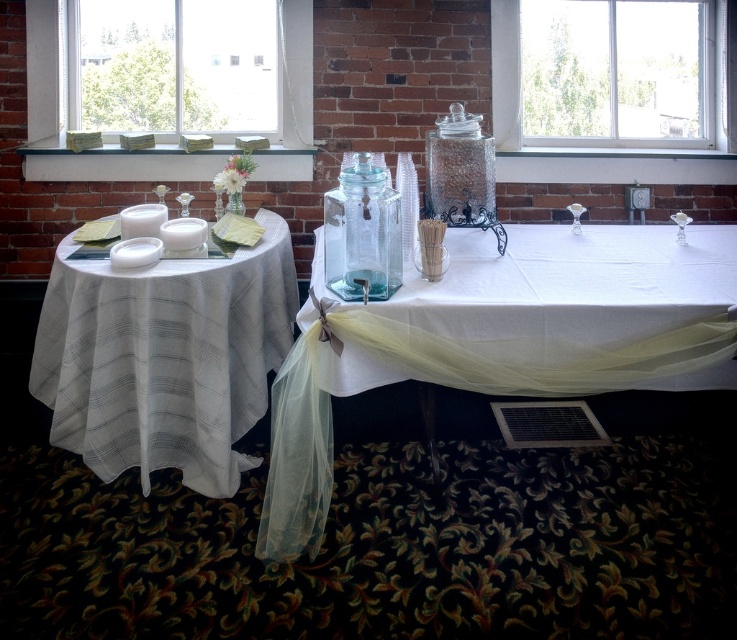
Measure the distance from translucent yellow fabric at lower center to green glass jars at upper left.

A distance of 1.56 meters exists between translucent yellow fabric at lower center and green glass jars at upper left.

Does point (680, 362) lie behind point (304, 83)?

No, (680, 362) is closer to viewer.

You are a GUI agent. You are given a task and a screenshot of the screen. Output one action in this format:
    pyautogui.click(x=<x>, y=<y>)
    Task: Click on the translucent yellow fabric at lower center
    The image size is (737, 640).
    Given the screenshot: What is the action you would take?
    pyautogui.click(x=499, y=342)

Does point (349, 273) come in front of point (178, 227)?

Yes, it is in front of point (178, 227).

Can you confirm if transparent glass beverage dispenser at center is wider than white matte candle at center?

Correct, the width of transparent glass beverage dispenser at center exceeds that of white matte candle at center.

Where is `transparent glass beverage dispenser at center`? transparent glass beverage dispenser at center is located at coordinates (363, 230).

Looking at this image, who is lower down, clear glass window at upper right or white matte candle at left?

white matte candle at left

Can you confirm if clear glass window at upper right is positioned above white matte candle at left?

Correct, clear glass window at upper right is located above white matte candle at left.

Is point (534, 145) positioned before point (158, 234)?

No, (534, 145) is further to viewer.

Where is `clear glass window at upper right`? This screenshot has height=640, width=737. clear glass window at upper right is located at coordinates (587, 136).